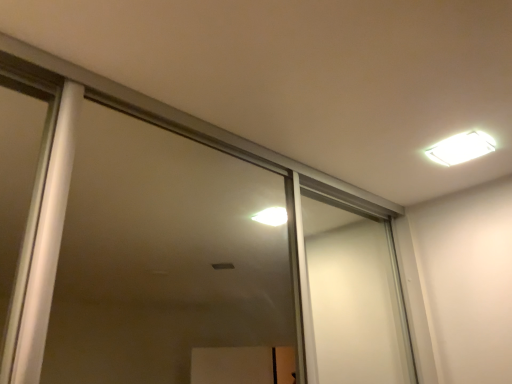
Describe the element at coordinates (461, 148) in the screenshot. This screenshot has height=384, width=512. I see `white glossy rectangular light fixture at upper right` at that location.

Find the location of a particular element. white glossy rectangular light fixture at upper right is located at coordinates (461, 148).

This screenshot has height=384, width=512. What are the coordinates of `white glossy rectangular light fixture at upper right` in the screenshot? It's located at (461, 148).